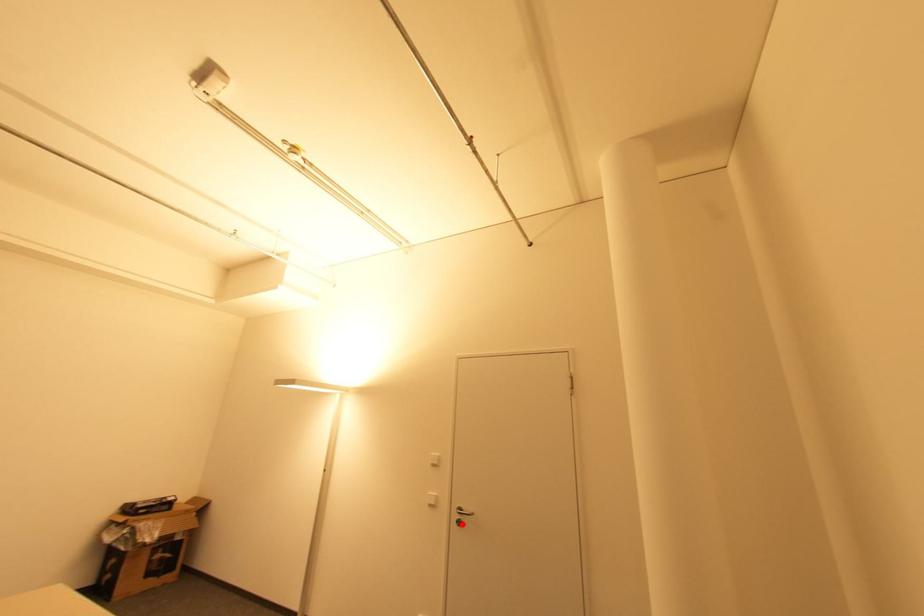
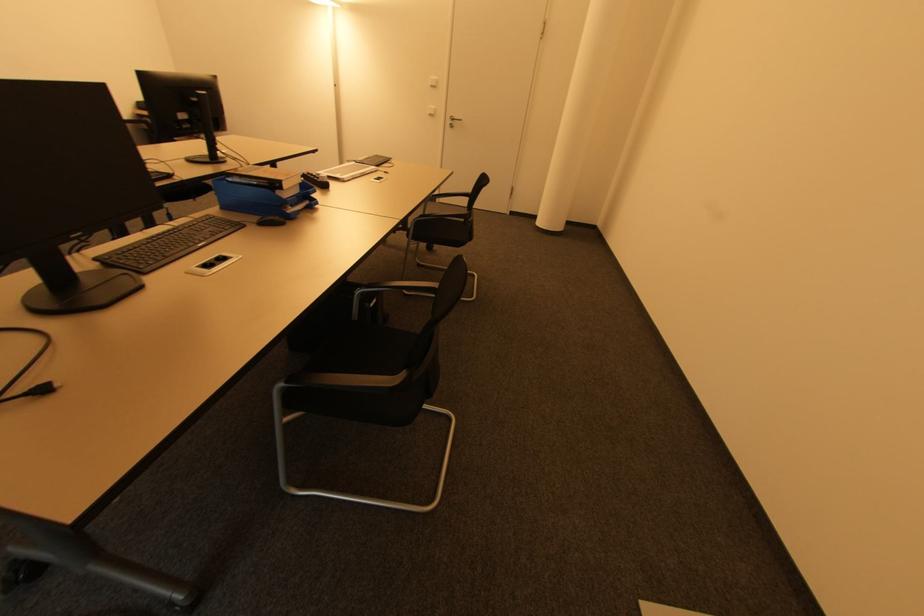
Question: I am providing you with two images of the same scene from different viewpoints. A red point is shown in image1. For the corresponding object point in image2, is it positioned nearer or farther from the camera?

Choices:
 (A) Nearer
 (B) Farther

Answer: (A)